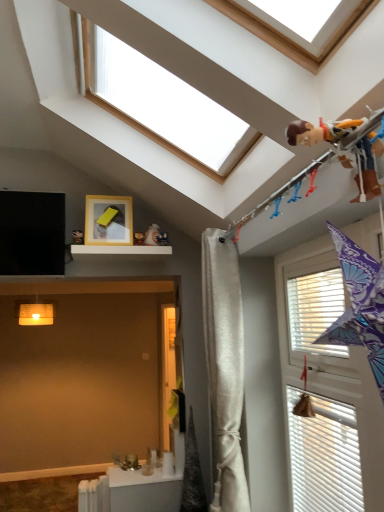
What do you see at coordinates (94, 495) in the screenshot?
I see `white metallic radiator at lower left` at bounding box center [94, 495].

In order to face white silky curtain at center, should I rotate leftwards or rightwards?

Rotate your view right by about 3.836°.

Where is `white silky curtain at center`? This screenshot has height=512, width=384. white silky curtain at center is located at coordinates (224, 367).

What do you see at coordinates (108, 220) in the screenshot? This screenshot has height=512, width=384. I see `matte yellow picture frame at upper center` at bounding box center [108, 220].

What do you see at coordinates (331, 371) in the screenshot? I see `white textured window at right, positioned as the 2th window in top-to-bottom order` at bounding box center [331, 371].

What do you see at coordinates (158, 102) in the screenshot?
I see `white wood window at upper center, the 2th window ordered from the bottom` at bounding box center [158, 102].

You are a GUI agent. You are given a task and a screenshot of the screen. Output one action in this format:
    pyautogui.click(x=<x>, y=<y>)
    Task: Click on the white metallic radiator at lower left
    The width and height of the screenshot is (384, 512).
    Given the screenshot: What is the action you would take?
    pyautogui.click(x=94, y=495)

Can you tell me how much white silky curtain at center and brown fabric toy at upper right differ in facing direction?

They differ by 6.45 degrees in their facing directions.

Between white silky curtain at center and brown fabric toy at upper right, which one has smaller width?

white silky curtain at center.

Does white silky curtain at center lie behind brown fabric toy at upper right?

Yes, white silky curtain at center is further from the camera.

Is white silky curtain at center next to brown fabric toy at upper right?

No, white silky curtain at center is not with brown fabric toy at upper right.

How distant is brown fabric toy at upper right from white metallic radiator at lower left?

brown fabric toy at upper right and white metallic radiator at lower left are 8.32 feet apart from each other.

Which of these two, brown fabric toy at upper right or white metallic radiator at lower left, stands shorter?

With less height is brown fabric toy at upper right.

From the image's perspective, who appears lower, brown fabric toy at upper right or white metallic radiator at lower left?

From the image's view, white metallic radiator at lower left is below.

Is brown fabric toy at upper right with white metallic radiator at lower left?

brown fabric toy at upper right is not next to white metallic radiator at lower left, and they're not touching.

In the scene shown: From the image's perspective, is brown fabric toy at upper right above or below white wood window at upper center, acting as the 1th window starting from the left?

brown fabric toy at upper right is below white wood window at upper center, acting as the 1th window starting from the left.

Is brown fabric toy at upper right inside the boundaries of white wood window at upper center, the first window positioned from the top, or outside?

brown fabric toy at upper right is not enclosed by white wood window at upper center, the first window positioned from the top.

Are brown fabric toy at upper right and white wood window at upper center, the first window positioned from the top, far apart?

That's not correct — brown fabric toy at upper right is a little close to white wood window at upper center, the first window positioned from the top.

What's the angular difference between brown fabric toy at upper right and white wood window at upper center, the 2th window ordered from the bottom,'s facing directions?

There is a 89.5-degree angle between the facing directions of brown fabric toy at upper right and white wood window at upper center, the 2th window ordered from the bottom.

Does matte yellow picture frame at upper center turn towards white matte shelf at upper center?

No, matte yellow picture frame at upper center is not facing towards white matte shelf at upper center.

Consider the image. Does matte yellow picture frame at upper center lie in front of white matte shelf at upper center?

No, matte yellow picture frame at upper center is further to the viewer.

Looking at this image, which is more to the left, matte yellow picture frame at upper center or white matte shelf at upper center?

matte yellow picture frame at upper center.

Considering the sizes of objects matte yellow picture frame at upper center and white matte shelf at upper center in the image provided, who is thinner, matte yellow picture frame at upper center or white matte shelf at upper center?

matte yellow picture frame at upper center is thinner.

At what (x,y) coordinates should I click in order to perform the action: click on window screen on the left side of white silky curtain at center. Please return your answer as a coordinate pair (x, y). Looking at the image, I should click on 32,233.

Which point is more forward, (4, 228) or (231, 243)?

The point (231, 243) is closer to the camera.

Does black matte screen at upper left have a smaller size compared to white silky curtain at center?

Indeed, black matte screen at upper left has a smaller size compared to white silky curtain at center.

Is matte yellow picture frame at upper center not near white metallic radiator at lower left?

Absolutely, matte yellow picture frame at upper center is distant from white metallic radiator at lower left.

Considering the positions of points (96, 243) and (97, 499), is point (96, 243) farther from camera compared to point (97, 499)?

That is False.

Between matte yellow picture frame at upper center and white metallic radiator at lower left, which one has smaller width?

matte yellow picture frame at upper center is thinner.

Based on their positions, is matte yellow picture frame at upper center located to the left or right of white metallic radiator at lower left?

matte yellow picture frame at upper center is positioned on white metallic radiator at lower left's right side.

Considering the sizes of objects white matte shelf at upper center and white metallic radiator at lower left in the image provided, who is wider, white matte shelf at upper center or white metallic radiator at lower left?

white matte shelf at upper center.

Is white matte shelf at upper center bigger or smaller than white metallic radiator at lower left?

white matte shelf at upper center is bigger than white metallic radiator at lower left.

What's the angular difference between white matte shelf at upper center and white metallic radiator at lower left's facing directions?

white matte shelf at upper center and white metallic radiator at lower left are facing 90.2 degrees away from each other.

You are a GUI agent. You are given a task and a screenshot of the screen. Output one action in this format:
    pyautogui.click(x=<x>, y=<y>)
    Task: Click on the radiator that appears on the left of white matte shelf at upper center
    
    Given the screenshot: What is the action you would take?
    pyautogui.click(x=94, y=495)

You are a GUI agent. You are given a task and a screenshot of the screen. Output one action in this format:
    pyautogui.click(x=<x>, y=<y>)
    Task: Click on the child above the white silky curtain at center (from a real-world perspective)
    
    Given the screenshot: What is the action you would take?
    pyautogui.click(x=346, y=143)

In order to click on radiator below the brown fabric toy at upper right (from a real-world perspective) in this screenshot , I will do `click(94, 495)`.

From the image, which object appears to be nearer to matte yellow picture frame at upper center, black matte screen at upper left or white textured window at right, arranged as the 1th window when viewed from the right?

The object closer to matte yellow picture frame at upper center is black matte screen at upper left.

Which object lies nearer to the anchor point white textured window at right, positioned as the 2th window in top-to-bottom order, white matte shelf at upper center or matte yellow picture frame at upper center?

Based on the image, white matte shelf at upper center appears to be nearer to white textured window at right, positioned as the 2th window in top-to-bottom order.

Looking at the image, which one is located further to matte yellow picture frame at upper center, white wood window at upper center, acting as the 1th window starting from the left, or black matte screen at upper left?

white wood window at upper center, acting as the 1th window starting from the left.

From the image, which object appears to be nearer to matte yellow picture frame at upper center, white silky curtain at center or white textured window at right, which ranks as the 1th window in bottom-to-top order?

Result: white silky curtain at center is positioned closer to the anchor matte yellow picture frame at upper center.

When comparing their distances from white textured window at right, positioned as the 2th window in top-to-bottom order, does matte yellow picture frame at upper center or white silky curtain at center seem further?

matte yellow picture frame at upper center is positioned further to the anchor white textured window at right, positioned as the 2th window in top-to-bottom order.

Which object lies nearer to the anchor point white silky curtain at center, brown fabric toy at upper right or black matte screen at upper left?

The object closer to white silky curtain at center is black matte screen at upper left.

Which object lies further to the anchor point matte yellow picture frame at upper center, white metallic radiator at lower left or black matte screen at upper left?

Based on the image, white metallic radiator at lower left appears to be further to matte yellow picture frame at upper center.

From the image, which object appears to be farther from black matte screen at upper left, white silky curtain at center or white metallic radiator at lower left?

white metallic radiator at lower left.

Identify the location of shelf between white textured window at right, arranged as the 1th window when viewed from the right, and matte yellow picture frame at upper center, along the z-axis. (120, 251).

Locate an element on the screen. The image size is (384, 512). picture frame between brown fabric toy at upper right and white metallic radiator at lower left in the up-down direction is located at coordinates (108, 220).

What are the coordinates of `shelf positioned between brown fabric toy at upper right and matte yellow picture frame at upper center from near to far` in the screenshot? It's located at (120, 251).

The image size is (384, 512). Identify the location of shelf between white wood window at upper center, which is the 2th window from right to left, and matte yellow picture frame at upper center, along the z-axis. (120, 251).